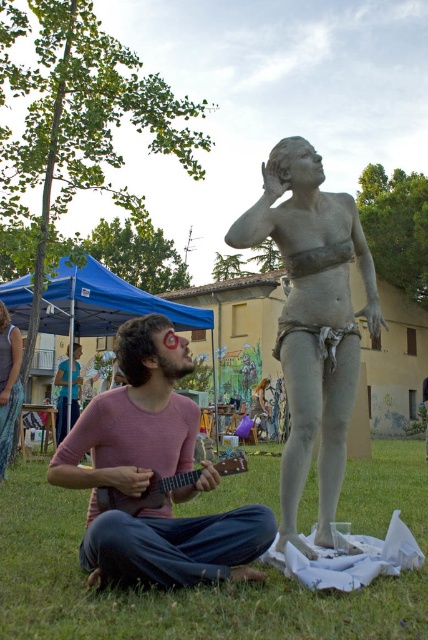
Does green grass at lower center have a lesser width compared to pink cotton shirt at center?

No.

Which of these two, green grass at lower center or pink cotton shirt at center, stands shorter?

With less height is pink cotton shirt at center.

Does point (15, 588) lie behind point (77, 429)?

No, (15, 588) is in front of (77, 429).

In order to click on green grass at lower center in this screenshot , I will do `click(208, 588)`.

Who is lower down, pink cotton shirt at center or wooden acoustic guitar at lower center?

Positioned lower is wooden acoustic guitar at lower center.

Does pink cotton shirt at center have a lesser width compared to wooden acoustic guitar at lower center?

In fact, pink cotton shirt at center might be wider than wooden acoustic guitar at lower center.

Where is `pink cotton shirt at center`? The width and height of the screenshot is (428, 640). pink cotton shirt at center is located at coordinates coord(151,474).

Does pink cotton shirt at center appear over matte clay statue at center?

Actually, pink cotton shirt at center is below matte clay statue at center.

Who is positioned more to the right, pink cotton shirt at center or matte clay statue at center?

matte clay statue at center

Measure the distance between point (128, 465) and camera.

10.27 feet

The width and height of the screenshot is (428, 640). I want to click on pink cotton shirt at center, so click(x=151, y=474).